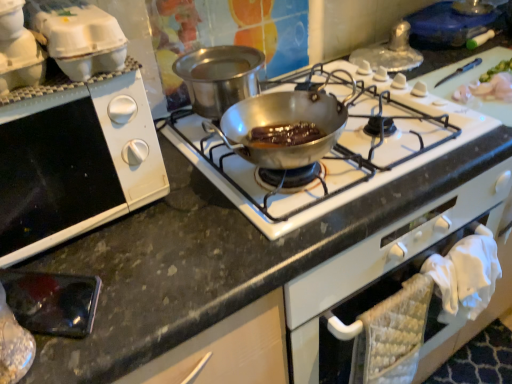
Identify the location of vacant area that lies to the right of white matte oven at left. This screenshot has height=384, width=512. (195, 223).